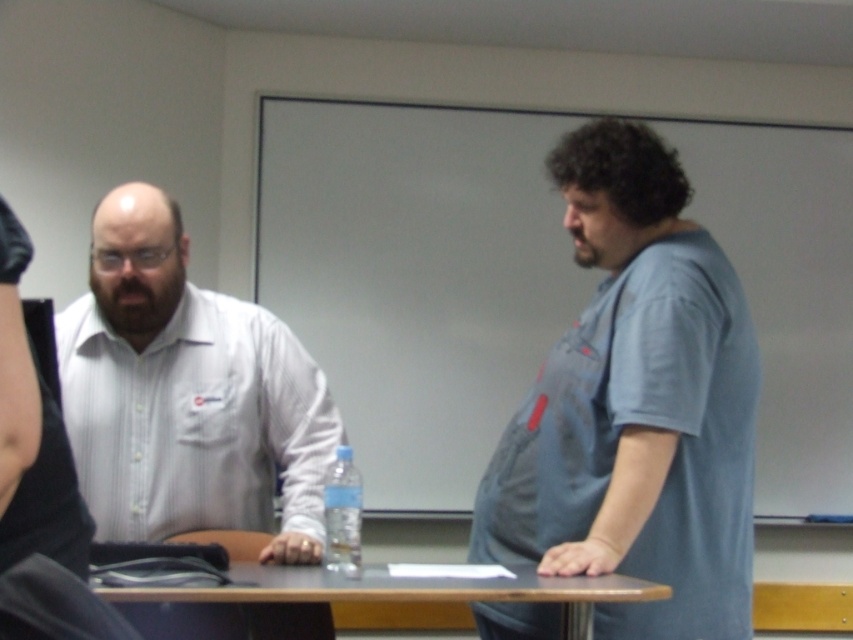
Question: Which object appears closest to the camera in this image?

Choices:
 (A) white striped shirt at left
 (B) clear plastic bottle at center
 (C) blue cotton shirt at right
 (D) brown wood table at center

Answer: (D)

Question: Which object is the closest to the whiteboard at upper center?

Choices:
 (A) white striped shirt at left
 (B) blue cotton shirt at right
 (C) brown wood table at center

Answer: (A)

Question: Can you confirm if whiteboard at upper center is wider than blue cotton shirt at right?

Choices:
 (A) yes
 (B) no

Answer: (A)

Question: Is brown wood table at center closer to camera compared to clear plastic bottle at center?

Choices:
 (A) no
 (B) yes

Answer: (B)

Question: Is whiteboard at upper center wider than white striped shirt at left?

Choices:
 (A) yes
 (B) no

Answer: (A)

Question: Which object is farther from the camera taking this photo?

Choices:
 (A) brown wood table at center
 (B) white striped shirt at left

Answer: (B)